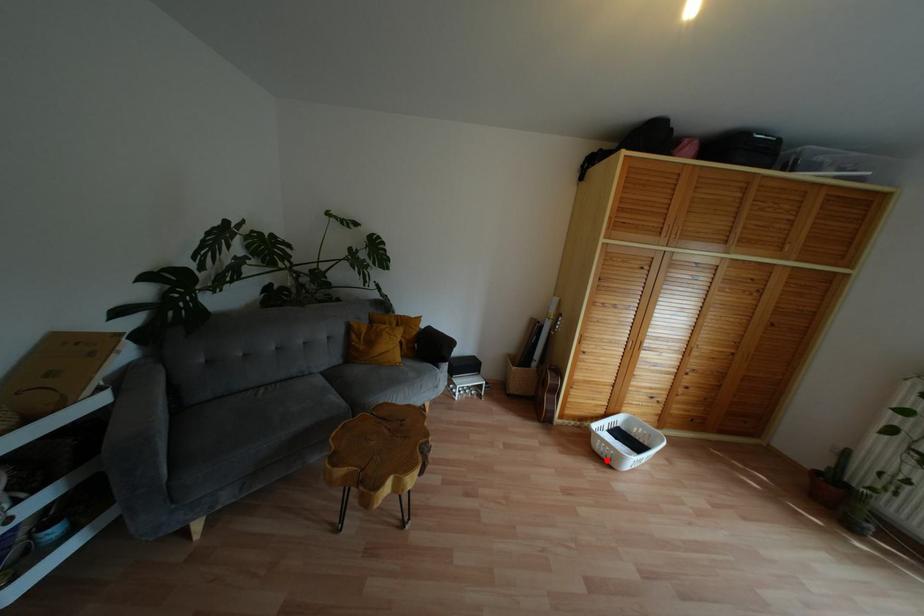
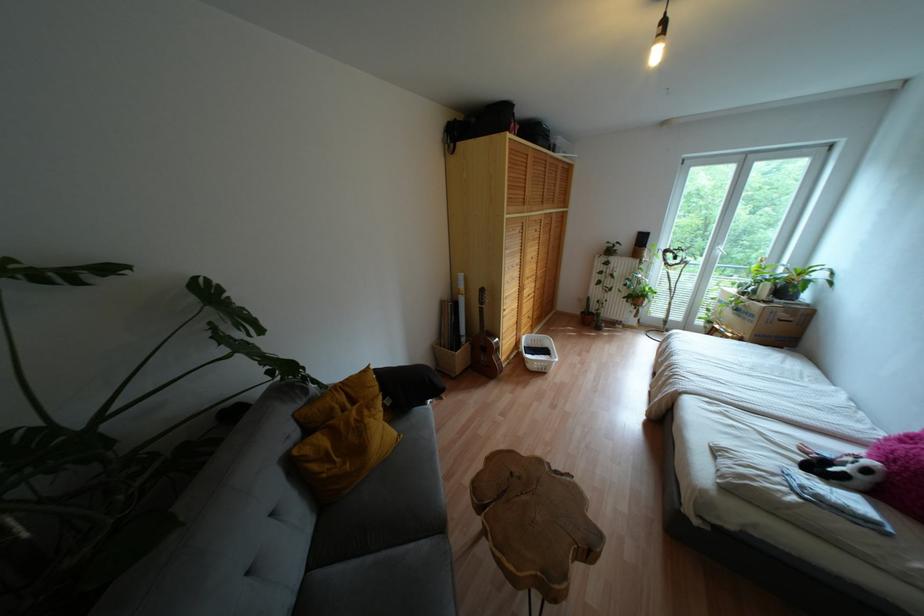
In the second image, find the point that corresponds to the highlighted location in the first image.

(542, 370)